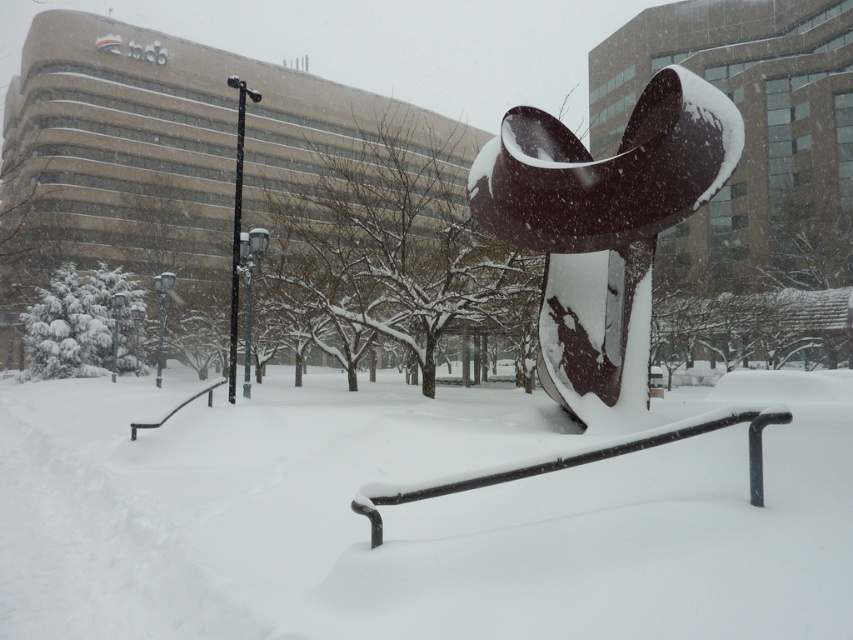
Question: Which object is the farthest from the white matte snow at center?

Choices:
 (A) black metal rail at lower center
 (B) black polished metal abstract sculpture at center

Answer: (A)

Question: Estimate the real-world distances between objects in this image. Which object is farther from the white matte snow at center?

Choices:
 (A) black metal rail at lower center
 (B) black polished metal abstract sculpture at center

Answer: (A)

Question: Is white matte snow at center wider than black polished metal abstract sculpture at center?

Choices:
 (A) yes
 (B) no

Answer: (A)

Question: Is black polished metal abstract sculpture at center bigger than black metal rail at lower center?

Choices:
 (A) no
 (B) yes

Answer: (B)

Question: Which of the following is the closest to the observer?

Choices:
 (A) (527, 109)
 (B) (380, 380)

Answer: (A)

Question: Is white matte snow at center positioned in front of black polished metal abstract sculpture at center?

Choices:
 (A) yes
 (B) no

Answer: (A)